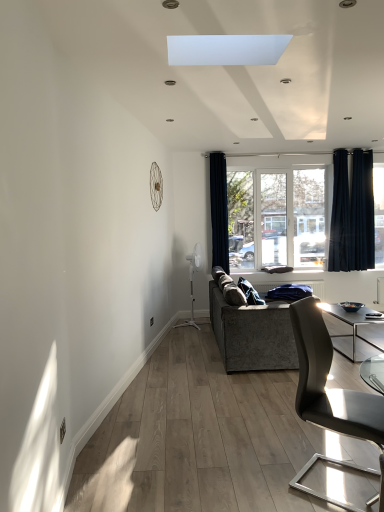
This screenshot has height=512, width=384. In order to click on black sheer curtain at right, which appears as the 2th curtain when viewed from the right in this screenshot , I will do `click(340, 215)`.

What do you see at coordinates (352, 213) in the screenshot?
I see `black velvet curtain at right, the 3th curtain positioned from the left` at bounding box center [352, 213].

Describe the element at coordinates (252, 334) in the screenshot. Image resolution: width=384 pixels, height=512 pixels. I see `textured gray couch at center` at that location.

I want to click on dark blue fabric curtain at center, marked as the 1th curtain in a left-to-right arrangement, so click(219, 211).

The height and width of the screenshot is (512, 384). Identify the location of blue fabric at center. (314, 287).

From a real-world perspective, count 3rd curtains upward from the matte black chair at lower right and point to it. Please provide its 2D coordinates.

[(340, 215)]

In terms of height, does black sheer curtain at right, which appears as the 2th curtain when viewed from the right, look taller or shorter compared to matte black chair at lower right?

Considering their sizes, black sheer curtain at right, which appears as the 2th curtain when viewed from the right, has more height than matte black chair at lower right.

Can you tell me how much black sheer curtain at right, which appears as the 2th curtain when viewed from the right, and matte black chair at lower right differ in facing direction?

48.1 degrees separate the facing orientations of black sheer curtain at right, which appears as the 2th curtain when viewed from the right, and matte black chair at lower right.

Between black sheer curtain at right, which appears as the 2th curtain when viewed from the right, and matte black chair at lower right, which one has smaller size?

black sheer curtain at right, which appears as the 2th curtain when viewed from the right, is smaller.

From the image's perspective, is black velvet curtain at right, the 3th curtain positioned from the left, above or below dark blue fabric curtain at center, marked as the 1th curtain in a left-to-right arrangement?

From the image's perspective, black velvet curtain at right, the 3th curtain positioned from the left, appears above dark blue fabric curtain at center, marked as the 1th curtain in a left-to-right arrangement.

Can you confirm if black velvet curtain at right, arranged as the first curtain when viewed from the right, is taller than dark blue fabric curtain at center, marked as the 1th curtain in a left-to-right arrangement?

Incorrect, the height of black velvet curtain at right, arranged as the first curtain when viewed from the right, is not larger of that of dark blue fabric curtain at center, marked as the 1th curtain in a left-to-right arrangement.

Considering the relative sizes of black velvet curtain at right, arranged as the first curtain when viewed from the right, and dark blue fabric curtain at center, which is counted as the third curtain, starting from the right, in the image provided, is black velvet curtain at right, arranged as the first curtain when viewed from the right, wider than dark blue fabric curtain at center, which is counted as the third curtain, starting from the right,?

In fact, black velvet curtain at right, arranged as the first curtain when viewed from the right, might be narrower than dark blue fabric curtain at center, which is counted as the third curtain, starting from the right.

Does black velvet curtain at right, the 3th curtain positioned from the left, turn towards dark blue fabric curtain at center, which is counted as the third curtain, starting from the right?

No, black velvet curtain at right, the 3th curtain positioned from the left, is not turned towards dark blue fabric curtain at center, which is counted as the third curtain, starting from the right.

Looking at their sizes, would you say clear glass window at center is wider or thinner than matte black chair at lower right?

Considering their sizes, clear glass window at center looks slimmer than matte black chair at lower right.

Based on the photo, considering the relative sizes of clear glass window at center and matte black chair at lower right in the image provided, is clear glass window at center taller than matte black chair at lower right?

Yes.

From a real-world perspective, is clear glass window at center physically above matte black chair at lower right?

Yes.

At what (x,y) coordinates should I click in order to perform the action: click on window located on the right of matte black chair at lower right. Please return your answer as a coordinate pair (x, y). Looking at the image, I should click on (280, 216).

Considering the relative positions of black velvet curtain at right, the 3th curtain positioned from the left, and blue fabric at center in the image provided, is black velvet curtain at right, the 3th curtain positioned from the left, to the left or to the right of blue fabric at center?

black velvet curtain at right, the 3th curtain positioned from the left, is to the right of blue fabric at center.

Choose the correct answer: Is black velvet curtain at right, the 3th curtain positioned from the left, inside blue fabric at center or outside it?

black velvet curtain at right, the 3th curtain positioned from the left, is located beyond the bounds of blue fabric at center.

Considering the relative sizes of black velvet curtain at right, arranged as the first curtain when viewed from the right, and blue fabric at center in the image provided, is black velvet curtain at right, arranged as the first curtain when viewed from the right, taller than blue fabric at center?

Correct, black velvet curtain at right, arranged as the first curtain when viewed from the right, is much taller as blue fabric at center.

Considering the relative sizes of black velvet curtain at right, arranged as the first curtain when viewed from the right, and blue fabric at center in the image provided, is black velvet curtain at right, arranged as the first curtain when viewed from the right, wider than blue fabric at center?

In fact, black velvet curtain at right, arranged as the first curtain when viewed from the right, might be narrower than blue fabric at center.

How different are the orientations of blue fabric at center and textured gray couch at center in degrees?

The angle between the facing direction of blue fabric at center and the facing direction of textured gray couch at center is 24.4 degrees.

Is blue fabric at center taller than textured gray couch at center?

No, blue fabric at center is not taller than textured gray couch at center.

Identify the location of radiator lying on the right of textured gray couch at center. This screenshot has width=384, height=512. (314, 287).

Does blue fabric at center have a greater width compared to textured gray couch at center?

Incorrect, the width of blue fabric at center does not surpass that of textured gray couch at center.

Is point (222, 223) positioned after point (316, 286)?

Yes, point (222, 223) is farther from viewer.

Identify the location of curtain on the left of blue fabric at center. The width and height of the screenshot is (384, 512). (219, 211).

How distant is dark blue fabric curtain at center, marked as the 1th curtain in a left-to-right arrangement, from blue fabric at center?

dark blue fabric curtain at center, marked as the 1th curtain in a left-to-right arrangement, and blue fabric at center are 1.56 meters apart.

Which is behind, dark blue fabric curtain at center, which is counted as the third curtain, starting from the right, or blue fabric at center?

dark blue fabric curtain at center, which is counted as the third curtain, starting from the right, is further away from the camera.

Is matte black chair at lower right further to camera compared to black velvet curtain at right, arranged as the first curtain when viewed from the right?

No.

Which is in front, point (360, 407) or point (359, 240)?

The point (360, 407) is more forward.

Consider the image. From the image's perspective, between matte black chair at lower right and black velvet curtain at right, the 3th curtain positioned from the left, who is located below?

matte black chair at lower right is shown below in the image.

I want to click on curtain that is the 3rd object above the matte black chair at lower right (from a real-world perspective), so click(x=340, y=215).

From the image's perspective, count 2nd curtains downward from the black velvet curtain at right, arranged as the first curtain when viewed from the right, and point to it. Please provide its 2D coordinates.

[(219, 211)]

Based on their spatial positions, is matte black chair at lower right or black velvet curtain at right, the 3th curtain positioned from the left, closer to textured gray couch at center?

matte black chair at lower right lies closer to textured gray couch at center than the other object.

Considering their positions, is dark blue fabric curtain at center, marked as the 1th curtain in a left-to-right arrangement, positioned closer to blue fabric at center than textured gray couch at center?

dark blue fabric curtain at center, marked as the 1th curtain in a left-to-right arrangement, lies closer to blue fabric at center than the other object.

Looking at the image, which one is located closer to black sheer curtain at right, which appears as the 2th curtain when viewed from the right, blue fabric at center or textured gray couch at center?

blue fabric at center is positioned closer to the anchor black sheer curtain at right, which appears as the 2th curtain when viewed from the right.

Based on the photo, when comparing their distances from matte black chair at lower right, does textured gray couch at center or blue fabric at center seem further?

Among the two, blue fabric at center is located further to matte black chair at lower right.

From the image, which object appears to be nearer to matte black chair at lower right, black sheer curtain at right, which appears as the 2th curtain when viewed from the right, or blue fabric at center?

Among the two, blue fabric at center is located nearer to matte black chair at lower right.

Estimate the real-world distances between objects in this image. Which object is closer to dark blue fabric curtain at center, which is counted as the third curtain, starting from the right, black sheer curtain at right, which is the second curtain from left to right, or textured gray couch at center?

black sheer curtain at right, which is the second curtain from left to right, is positioned closer to the anchor dark blue fabric curtain at center, which is counted as the third curtain, starting from the right.

Which object lies further to the anchor point matte black chair at lower right, dark blue fabric curtain at center, which is counted as the third curtain, starting from the right, or black velvet curtain at right, arranged as the first curtain when viewed from the right?

The object further to matte black chair at lower right is dark blue fabric curtain at center, which is counted as the third curtain, starting from the right.

Looking at the image, which one is located further to blue fabric at center, black velvet curtain at right, the 3th curtain positioned from the left, or dark blue fabric curtain at center, which is counted as the third curtain, starting from the right?

Among the two, dark blue fabric curtain at center, which is counted as the third curtain, starting from the right, is located further to blue fabric at center.

This screenshot has height=512, width=384. What are the coordinates of `studio couch between matte black chair at lower right and blue fabric at center from front to back` in the screenshot? It's located at (252, 334).

Where is `curtain between textured gray couch at center and black sheer curtain at right, which appears as the 2th curtain when viewed from the right, from front to back`? curtain between textured gray couch at center and black sheer curtain at right, which appears as the 2th curtain when viewed from the right, from front to back is located at coordinates (219, 211).

Identify the location of radiator between textured gray couch at center and black velvet curtain at right, arranged as the first curtain when viewed from the right, along the z-axis. (314, 287).

Where is `radiator located between dark blue fabric curtain at center, which is counted as the third curtain, starting from the right, and black sheer curtain at right, which is the second curtain from left to right, in the left-right direction`? Image resolution: width=384 pixels, height=512 pixels. radiator located between dark blue fabric curtain at center, which is counted as the third curtain, starting from the right, and black sheer curtain at right, which is the second curtain from left to right, in the left-right direction is located at coordinates (314, 287).